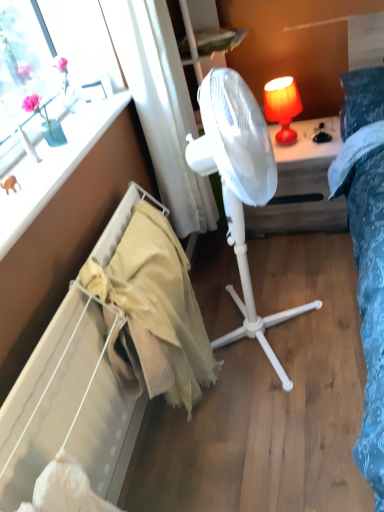
Where is `free spot below white plastic fan at center (from a real-world perspective)`? This screenshot has height=512, width=384. free spot below white plastic fan at center (from a real-world perspective) is located at coordinates (274, 336).